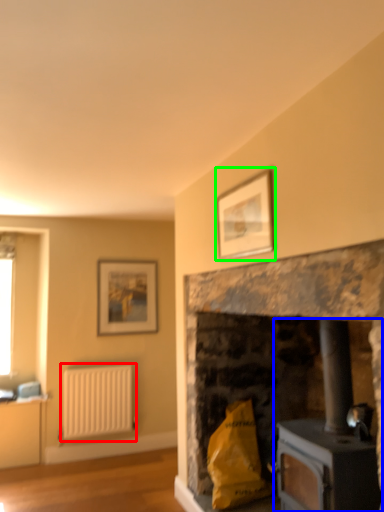
Question: Which object is positioned closest to radiator (highlighted by a red box)? Select from wood burning stove (highlighted by a blue box) and picture frame (highlighted by a green box).

Choices:
 (A) wood burning stove
 (B) picture frame

Answer: (A)